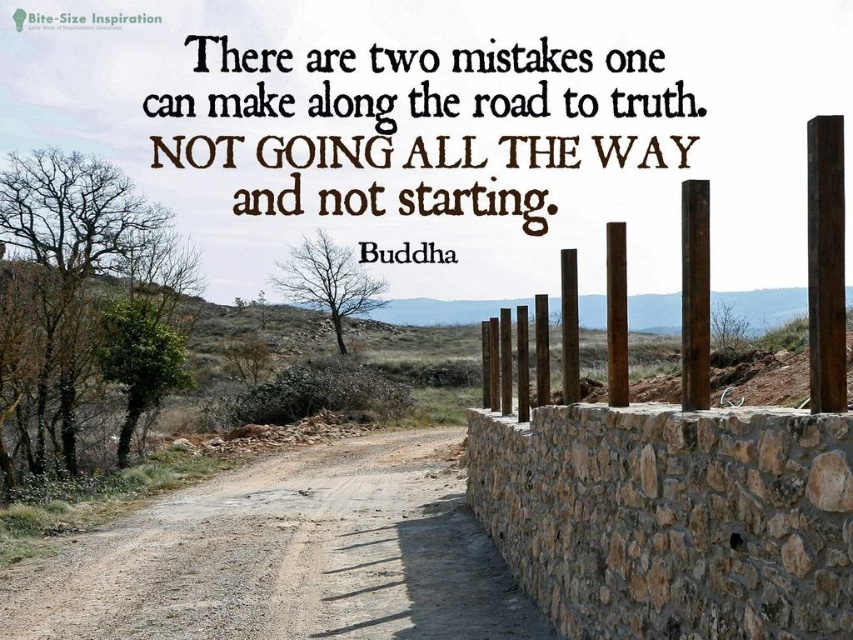
You are a hiker who wants to take a shortcut from the brown gravel road at center to the rustic wood posts at right. Can you walk directly between them?

The brown gravel road at center is to the left of rustic wood posts at right, so you can walk directly between them.

You are a delivery person with a cart that is 5 meters long. You see the brown gravel road at center and the rustic wood posts at right. Can your cart fit between them without bending?

The distance between the brown gravel road at center and rustic wood posts at right is 4.76 meters. Since the cart is 5 meters long, it cannot fit between them without bending.